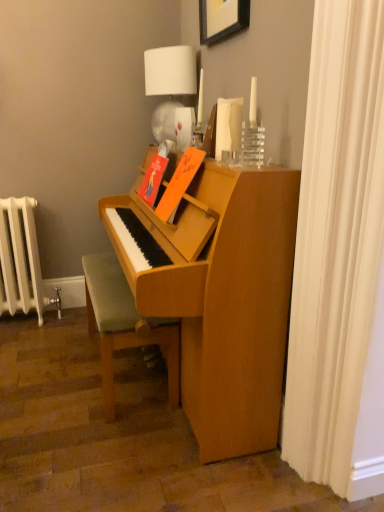
Question: Does light brown wooden bench at lower center come in front of white painted metal radiator at left?

Choices:
 (A) yes
 (B) no

Answer: (A)

Question: Can you confirm if light brown wooden bench at lower center is bigger than white painted metal radiator at left?

Choices:
 (A) no
 (B) yes

Answer: (B)

Question: Is light brown wooden bench at lower center oriented towards white painted metal radiator at left?

Choices:
 (A) no
 (B) yes

Answer: (A)

Question: Does light brown wooden bench at lower center appear on the right side of white painted metal radiator at left?

Choices:
 (A) yes
 (B) no

Answer: (A)

Question: Does light brown wooden bench at lower center have a greater height compared to white painted metal radiator at left?

Choices:
 (A) yes
 (B) no

Answer: (B)

Question: Considering the relative positions of light brown wooden bench at lower center and white painted metal radiator at left in the image provided, is light brown wooden bench at lower center behind white painted metal radiator at left?

Choices:
 (A) no
 (B) yes

Answer: (A)

Question: Is white fabric shower curtain at right smaller than white painted metal radiator at left?

Choices:
 (A) yes
 (B) no

Answer: (A)

Question: Is white fabric shower curtain at right to the left of white painted metal radiator at left from the viewer's perspective?

Choices:
 (A) yes
 (B) no

Answer: (B)

Question: Is white painted metal radiator at left located within white fabric shower curtain at right?

Choices:
 (A) no
 (B) yes

Answer: (A)

Question: Is white fabric shower curtain at right thinner than white painted metal radiator at left?

Choices:
 (A) no
 (B) yes

Answer: (B)

Question: Does white fabric shower curtain at right have a larger size compared to white painted metal radiator at left?

Choices:
 (A) no
 (B) yes

Answer: (A)

Question: Considering the relative sizes of white fabric shower curtain at right and white painted metal radiator at left in the image provided, is white fabric shower curtain at right shorter than white painted metal radiator at left?

Choices:
 (A) no
 (B) yes

Answer: (A)

Question: Can you confirm if wooden picture frame at upper center is smaller than white fabric shower curtain at right?

Choices:
 (A) yes
 (B) no

Answer: (A)